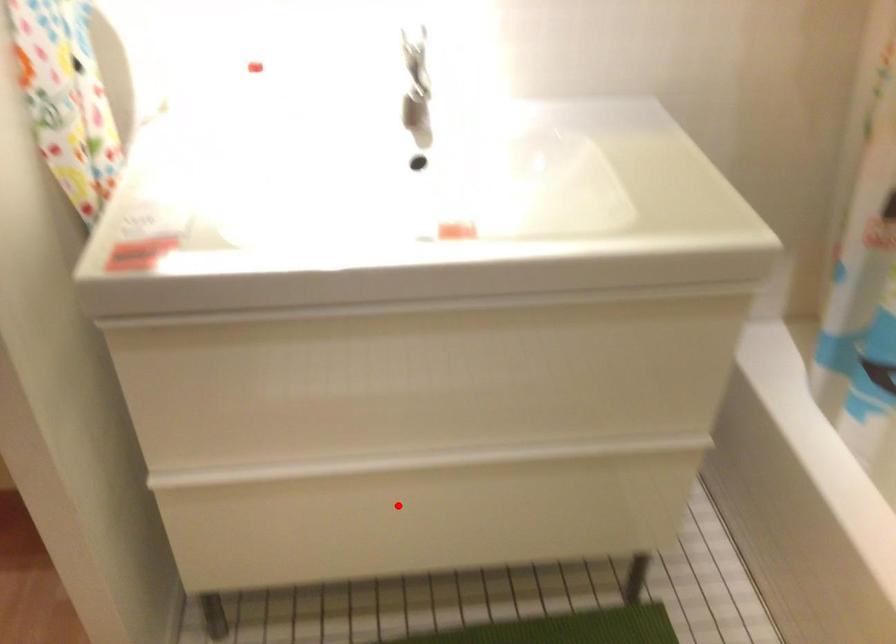
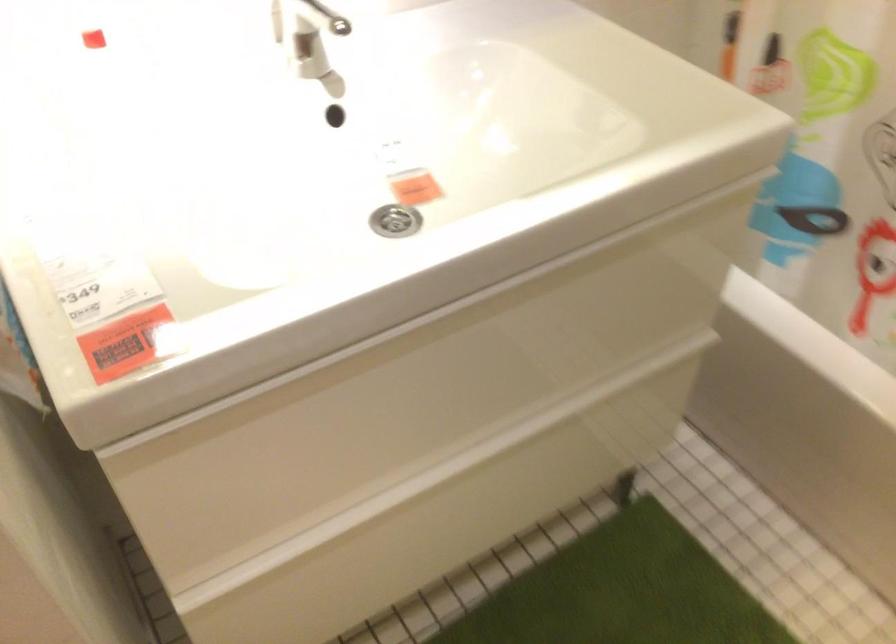
In the second image, find the point that corresponds to the highlighted location in the first image.

(442, 514)